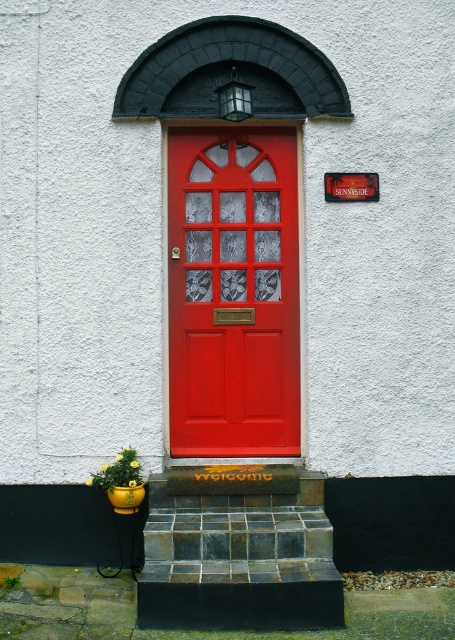
Question: Which point appears farthest from the camera in this image?

Choices:
 (A) (x=171, y=321)
 (B) (x=308, y=541)

Answer: (A)

Question: Is matte red door at center below dark gray stone stairs at center?

Choices:
 (A) yes
 (B) no

Answer: (B)

Question: Is matte red door at center above dark gray stone stairs at center?

Choices:
 (A) yes
 (B) no

Answer: (A)

Question: Does matte red door at center have a greater width compared to dark gray stone stairs at center?

Choices:
 (A) yes
 (B) no

Answer: (B)

Question: Among these points, which one is nearest to the camera?

Choices:
 (A) (335, 582)
 (B) (254, 417)

Answer: (A)

Question: Which of the following is the closest to the observer?

Choices:
 (A) (244, 504)
 (B) (227, 440)

Answer: (A)